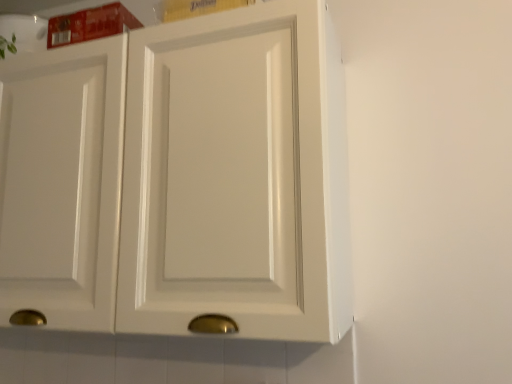
Locate an element on the screen. This screenshot has height=384, width=512. white glossy cupboard at upper center is located at coordinates (181, 178).

Image resolution: width=512 pixels, height=384 pixels. Describe the element at coordinates (181, 178) in the screenshot. I see `white glossy cupboard at upper center` at that location.

In order to click on white glossy cupboard at upper center in this screenshot , I will do `click(181, 178)`.